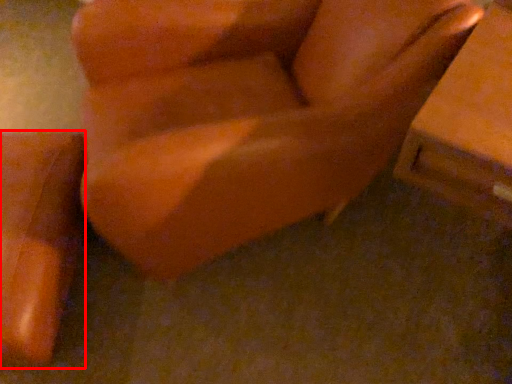
Question: From the image's perspective, what is the correct spatial positioning of furniture (annotated by the red box) in reference to furniture?

Choices:
 (A) below
 (B) above

Answer: (A)